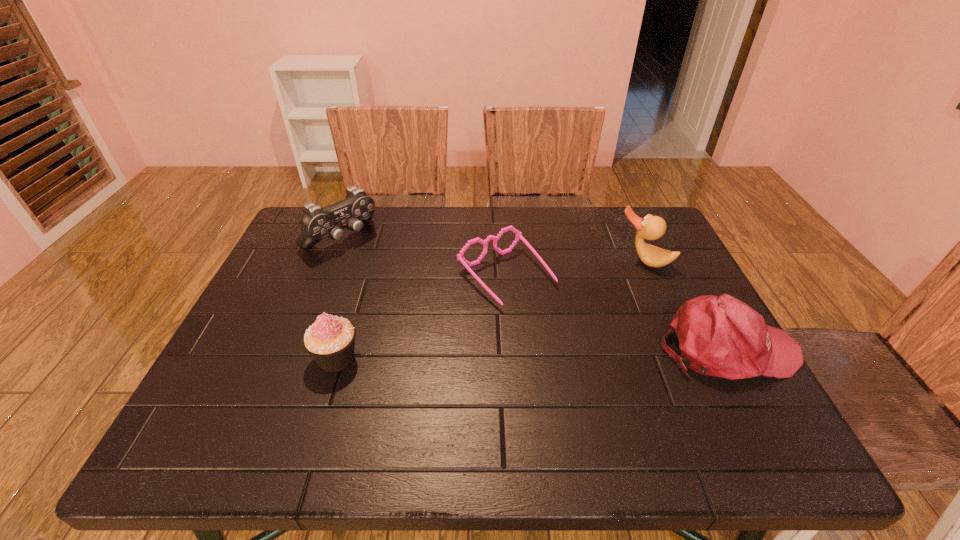
What are the coordinates of `cupcake` in the screenshot? It's located at (330, 340).

You are a GUI agent. You are given a task and a screenshot of the screen. Output one action in this format:
    pyautogui.click(x=<x>, y=<y>)
    Task: Click on the baseball cap
    This screenshot has height=540, width=960.
    Given the screenshot: What is the action you would take?
    pyautogui.click(x=721, y=336)

The height and width of the screenshot is (540, 960). In order to click on duck in this screenshot , I will do `click(651, 227)`.

You are a GUI agent. You are given a task and a screenshot of the screen. Output one action in this format:
    pyautogui.click(x=<x>, y=<y>)
    Task: Click on the control
    
    Given the screenshot: What is the action you would take?
    pyautogui.click(x=357, y=208)

Identify the location of spectacles. The image size is (960, 540). (460, 257).

Locate an element on the screen. The height and width of the screenshot is (540, 960). the shortest object is located at coordinates (460, 257).

In order to click on free spot located on the back of the cupcake in this screenshot , I will do 372,240.

I want to click on vacant point located on the beak of the duck, so click(609, 313).

Where is `vacant point located on the beak of the duck`? vacant point located on the beak of the duck is located at coordinates (583, 356).

Where is `blank area located on the beak of the duck`? blank area located on the beak of the duck is located at coordinates (610, 310).